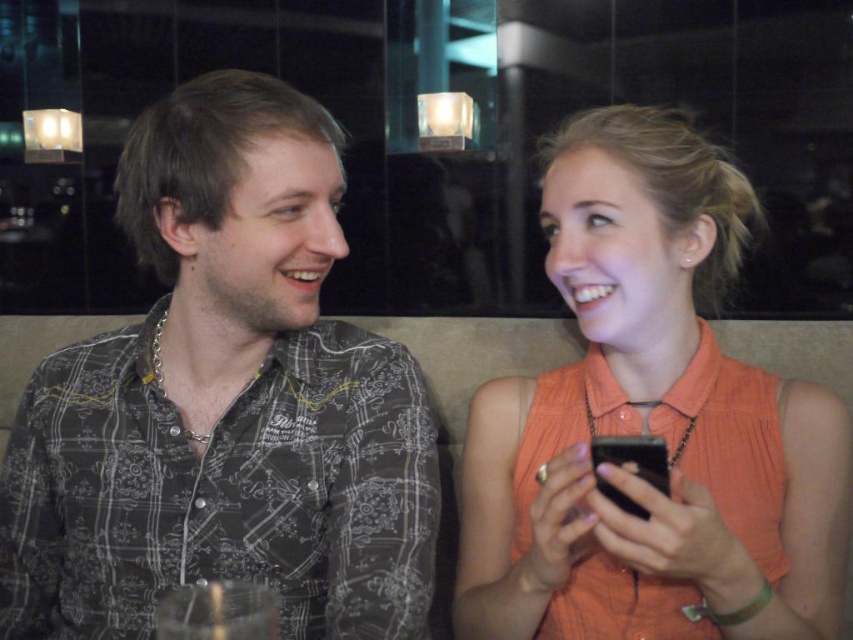
Question: Which object appears closest to the camera in this image?

Choices:
 (A) matte black smartphone at center
 (B) dark gray printed shirt at left
 (C) orange fabric shirt at center

Answer: (C)

Question: In this image, where is dark gray printed shirt at left located relative to orange fabric shirt at center?

Choices:
 (A) right
 (B) left

Answer: (B)

Question: Does dark gray printed shirt at left appear over matte black smartphone at center?

Choices:
 (A) no
 (B) yes

Answer: (B)

Question: Can you confirm if orange fabric shirt at center is positioned to the right of matte black smartphone at center?

Choices:
 (A) no
 (B) yes

Answer: (B)

Question: Estimate the real-world distances between objects in this image. Which object is closer to the orange fabric shirt at center?

Choices:
 (A) matte black smartphone at center
 (B) dark gray printed shirt at left

Answer: (A)

Question: Among these points, which one is nearest to the camera?

Choices:
 (A) (654, 442)
 (B) (115, 472)

Answer: (A)